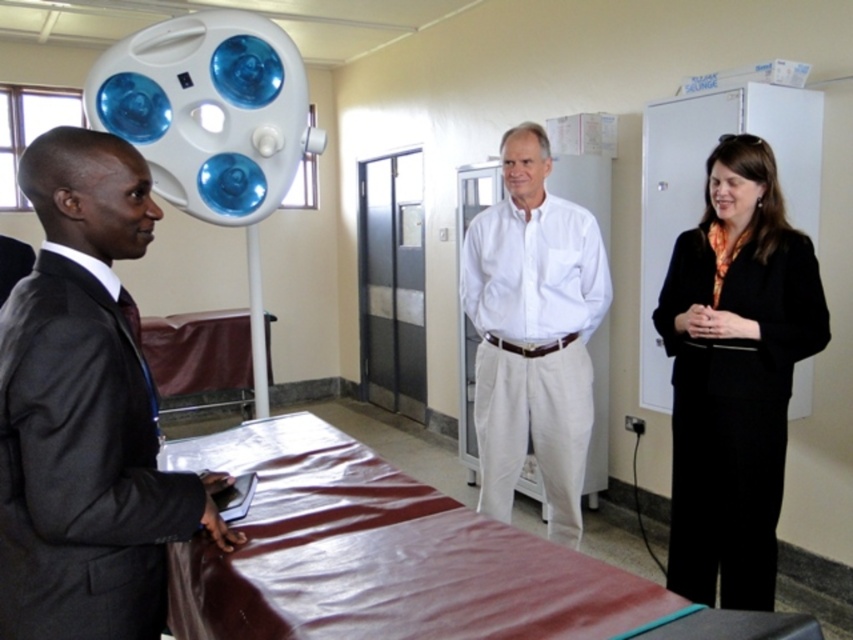
Is dark gray suit at center further to camera compared to black smooth suit at right?

That is False.

Is dark gray suit at center above black smooth suit at right?

Yes, dark gray suit at center is above black smooth suit at right.

I want to click on dark gray suit at center, so click(85, 412).

Is black smooth suit at right to the left of white cotton shirt at center from the viewer's perspective?

In fact, black smooth suit at right is to the right of white cotton shirt at center.

Does black smooth suit at right have a larger size compared to white cotton shirt at center?

No.

This screenshot has height=640, width=853. In order to click on black smooth suit at right in this screenshot , I will do `click(734, 374)`.

At what (x,y) coordinates should I click in order to perform the action: click on black smooth suit at right. Please return your answer as a coordinate pair (x, y). Looking at the image, I should click on (734, 374).

Which is in front, point (137, 317) or point (538, 333)?

Point (137, 317) is in front.

Can you confirm if dark gray suit at center is positioned to the left of white cotton shirt at center?

Correct, you'll find dark gray suit at center to the left of white cotton shirt at center.

At what (x,y) coordinates should I click in order to perform the action: click on dark gray suit at center. Please return your answer as a coordinate pair (x, y). Looking at the image, I should click on 85,412.

Find the location of a particular element. This screenshot has height=640, width=853. dark gray suit at center is located at coordinates (85, 412).